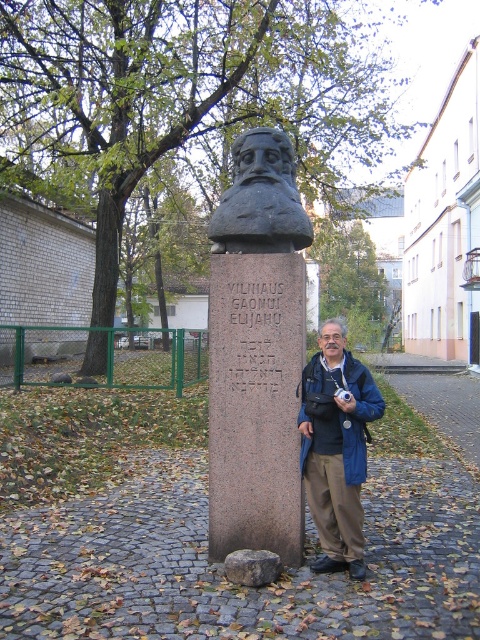
Question: Is blue fabric jacket at center further to camera compared to black stone bust at center?

Choices:
 (A) yes
 (B) no

Answer: (B)

Question: Is granite bust at center thinner than black stone bust at center?

Choices:
 (A) yes
 (B) no

Answer: (A)

Question: Does granite bust at center have a smaller size compared to blue fabric jacket at center?

Choices:
 (A) no
 (B) yes

Answer: (A)

Question: Which point is farther to the camera?

Choices:
 (A) blue fabric jacket at center
 (B) black stone bust at center
 (C) granite bust at center

Answer: (B)

Question: Which object is the farthest from the blue fabric jacket at center?

Choices:
 (A) granite bust at center
 (B) black stone bust at center

Answer: (B)

Question: Considering the real-world distances, which object is farthest from the black stone bust at center?

Choices:
 (A) blue fabric jacket at center
 (B) granite bust at center

Answer: (A)